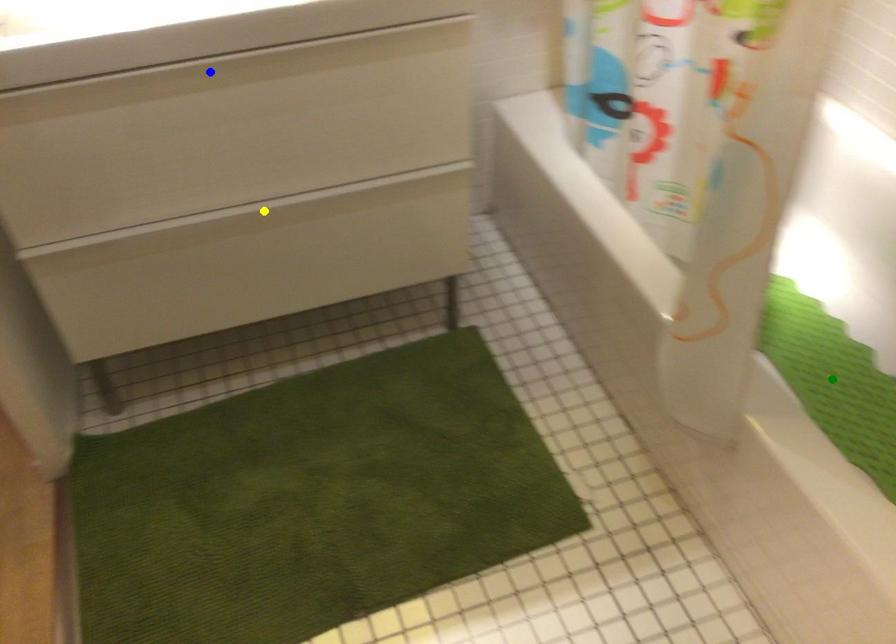
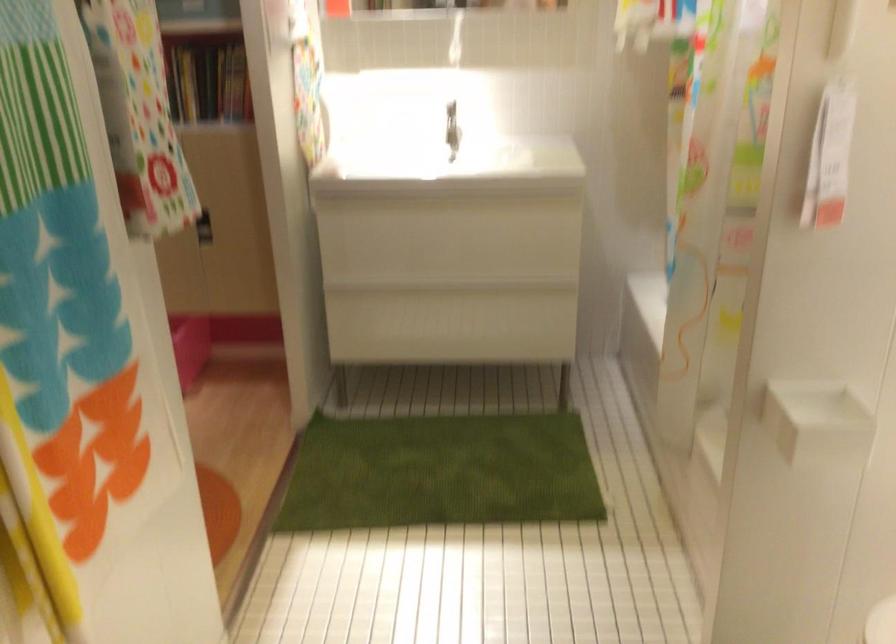
I am providing you with two images of the same scene from different viewpoints. Three points are marked in image1. Which point corresponds to a part or object that is occluded in image2?In image1, three points are marked. Which of them correspond to a part or object that is occluded in image2?Among the three points shown in image1, which one corresponds to a part or object that is no longer visible due to occlusion in image2?

green point cannot be seen in image2.